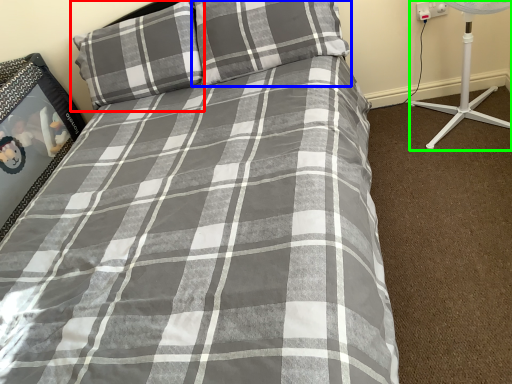
Question: Which is farther away from pillow (highlighted by a red box)? pillow (highlighted by a blue box) or fan (highlighted by a green box)?

Choices:
 (A) pillow
 (B) fan

Answer: (B)